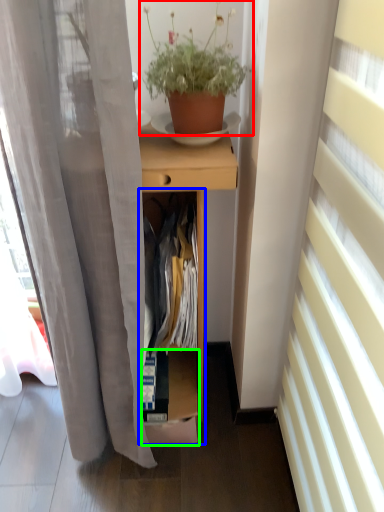
Question: Which is farther away from houseplant (highlighted by a red box)? cabinet (highlighted by a blue box) or shelf (highlighted by a green box)?

Choices:
 (A) cabinet
 (B) shelf

Answer: (B)